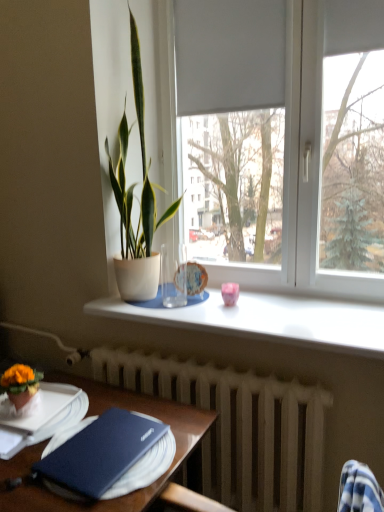
Question: From the image's perspective, is porcelain plate at center, which is the first tableware in left-to-right order, above or below orange felt flower pot at lower left, placed as the second houseplant when sorted from right to left?

Choices:
 (A) below
 (B) above

Answer: (B)

Question: Relative to orange felt flower pot at lower left, the second houseplant in the back-to-front sequence, is porcelain plate at center, which is the first tableware in left-to-right order, in front or behind?

Choices:
 (A) behind
 (B) front

Answer: (A)

Question: Which object is the farthest from the white textured radiator at lower center?

Choices:
 (A) white matte window at center
 (B) wooden table at lower left
 (C) matte blue hardback book at lower left
 (D) pink glossy cup at center, the 2th tableware from the back
 (E) white smooth window sill at center

Answer: (A)

Question: Which object is the closest to the white matte window at center?

Choices:
 (A) porcelain plate at center, arranged as the second tableware when viewed from the right
 (B) wooden table at lower left
 (C) white textured radiator at lower center
 (D) orange felt flower pot at lower left, the 2th houseplant positioned from the top
 (E) pink glossy cup at center, the 2th tableware from the back

Answer: (A)